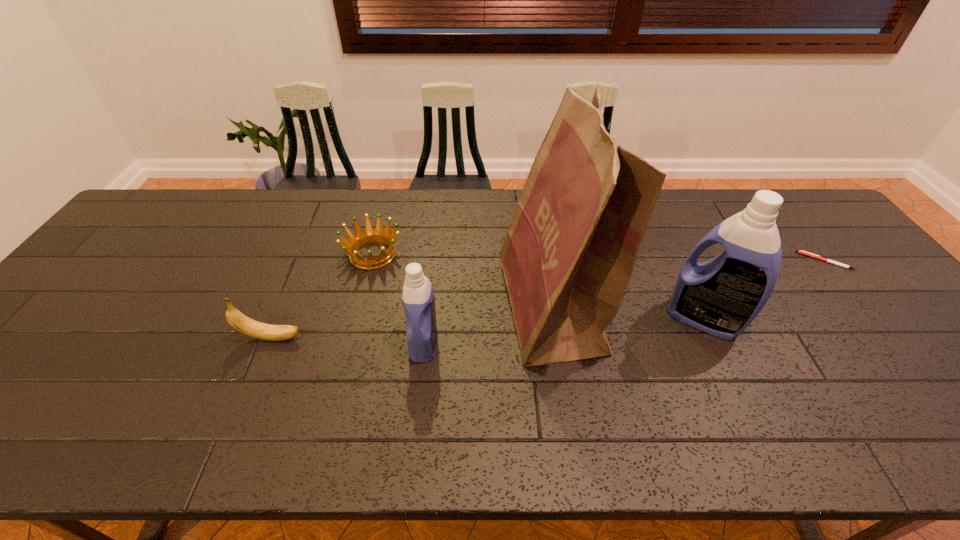
Find the location of a particular element. This screenshot has height=540, width=960. the left detergent is located at coordinates (418, 299).

At what (x,y) coordinates should I click in order to perform the action: click on the fourth shortest object. Please return your answer as a coordinate pair (x, y). Looking at the image, I should click on (418, 299).

The width and height of the screenshot is (960, 540). In order to click on the taller detergent in this screenshot , I will do `click(722, 296)`.

Where is `the right detergent`? The height and width of the screenshot is (540, 960). the right detergent is located at coordinates (722, 296).

Find the location of a particular element. the second shortest object is located at coordinates (370, 236).

This screenshot has width=960, height=540. Find the location of `the fifth object from right to left`. the fifth object from right to left is located at coordinates (370, 236).

You are a GUI agent. You are given a task and a screenshot of the screen. Output one action in this format:
    pyautogui.click(x=<x>, y=<y>)
    Task: Click on the rightmost object
    The width and height of the screenshot is (960, 540).
    Given the screenshot: What is the action you would take?
    pyautogui.click(x=800, y=252)

This screenshot has height=540, width=960. I want to click on pen, so click(x=800, y=252).

Locate an element on the screen. The height and width of the screenshot is (540, 960). the leftmost object is located at coordinates (244, 324).

Where is `banana`? banana is located at coordinates (244, 324).